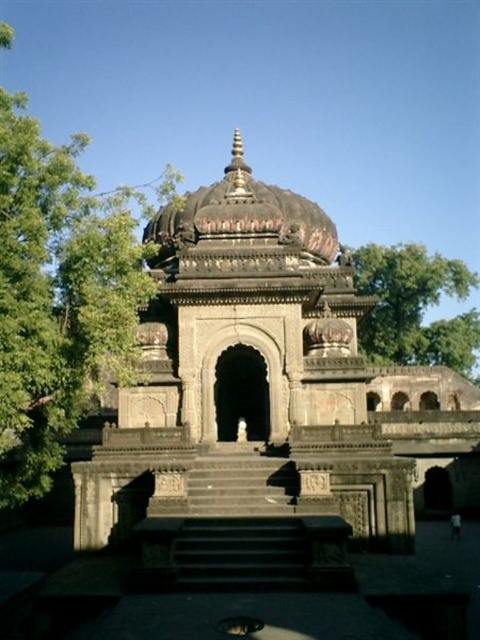
Between point (115, 433) and point (395, 316), which one is positioned behind?

Point (395, 316)

The width and height of the screenshot is (480, 640). In order to click on dark stone dome at center in this screenshot , I will do `click(264, 396)`.

Which is behind, point (467, 358) or point (257, 200)?

Point (467, 358)

Where is `green leafy tree at upper right`? green leafy tree at upper right is located at coordinates (415, 307).

Who is more forward, (236,444) or (99,360)?

Point (99,360) is in front.

Does dark stone dome at center have a larger size compared to green leafy tree at left?

Actually, dark stone dome at center might be smaller than green leafy tree at left.

Where is `dark stone dome at center`? This screenshot has width=480, height=640. dark stone dome at center is located at coordinates (264, 396).

At what (x,y) coordinates should I click in order to perform the action: click on dark stone dome at center. Please return your answer as a coordinate pair (x, y). Looking at the image, I should click on (264, 396).